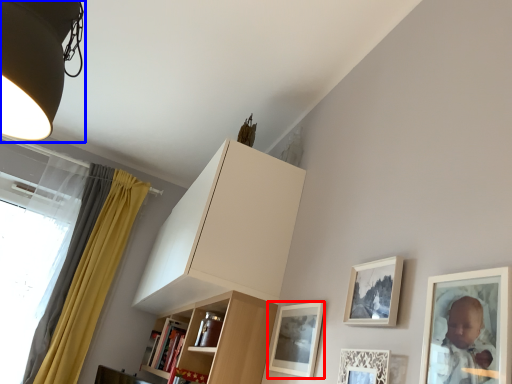
Question: Which of the following is the farthest to the observer, picture frame (highlighted by a red box) or lamp (highlighted by a blue box)?

Choices:
 (A) picture frame
 (B) lamp

Answer: (A)